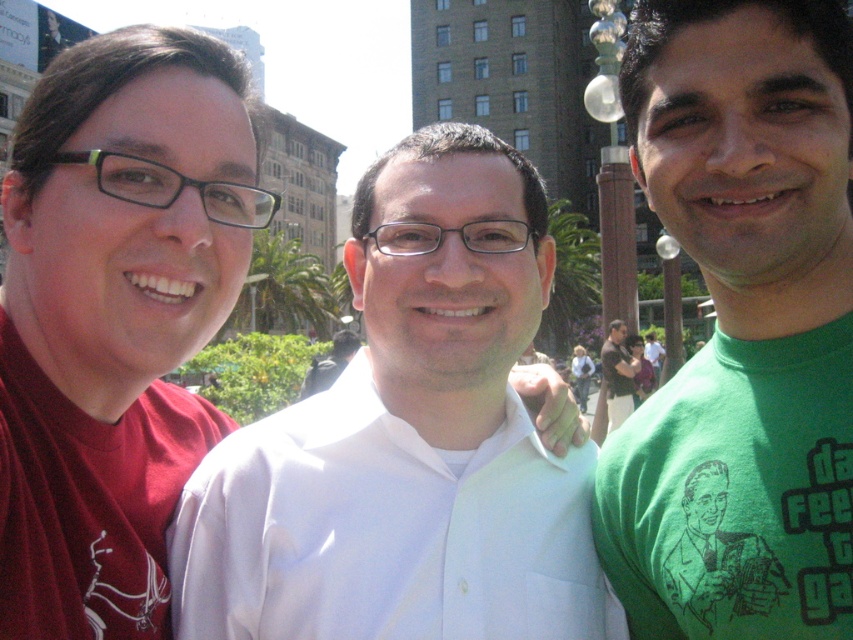
You are a photographer trying to capture a group photo of the three people in the scene. You want to arrange them so that the person wearing the white cotton shirt at center is positioned to the right of the person with blonde hair at center. Is this possible based on their current positions?

The white cotton shirt at center is currently to the left of blonde hair at center, so to position the white cotton shirt at center to the right of blonde hair at center, they would need to swap places. This is possible by moving the white cotton shirt at center to the right side and the blonde hair at center to the left side.

You are standing at the point labeled as point [723,202] and want to take a photo of the three people in the scene. The camera you have can focus on subjects within 40 meters. Will the camera be able to focus on the three people?

The distance between point [723,202] and the camera is 40.57 meters. Since the camera can focus up to 40 meters, it is slightly beyond the camera range. Therefore, the camera may not be able to focus on the three people.